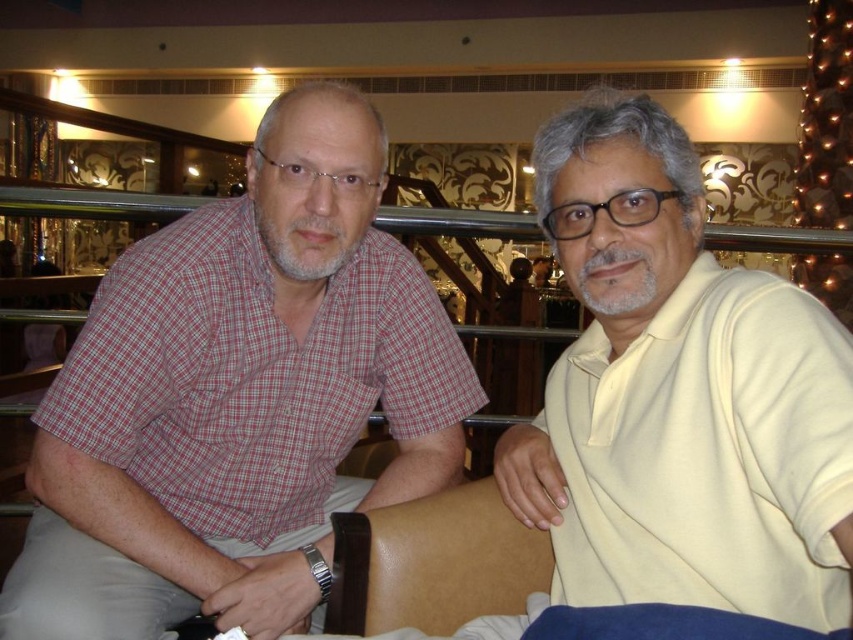
Question: Which point is farther to the camera?

Choices:
 (A) (405, 612)
 (B) (851, 522)
 (C) (440, 417)

Answer: (C)

Question: Estimate the real-world distances between objects in this image. Which object is closer to the red checkered shirt at left?

Choices:
 (A) brown leather chair at center
 (B) yellow matte shirt at right

Answer: (A)

Question: Observing the image, what is the correct spatial positioning of red checkered shirt at left in reference to yellow matte shirt at right?

Choices:
 (A) above
 (B) below

Answer: (B)

Question: Is the position of red checkered shirt at left less distant than that of yellow matte shirt at right?

Choices:
 (A) yes
 (B) no

Answer: (B)

Question: Is red checkered shirt at left positioned at the back of brown leather chair at center?

Choices:
 (A) yes
 (B) no

Answer: (B)

Question: Which object appears closest to the camera in this image?

Choices:
 (A) brown leather chair at center
 (B) yellow matte shirt at right

Answer: (B)